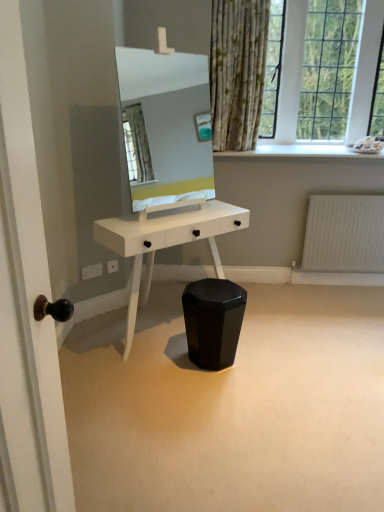
Find the location of a particular element. free location in front of white glossy table at center is located at coordinates pos(209,410).